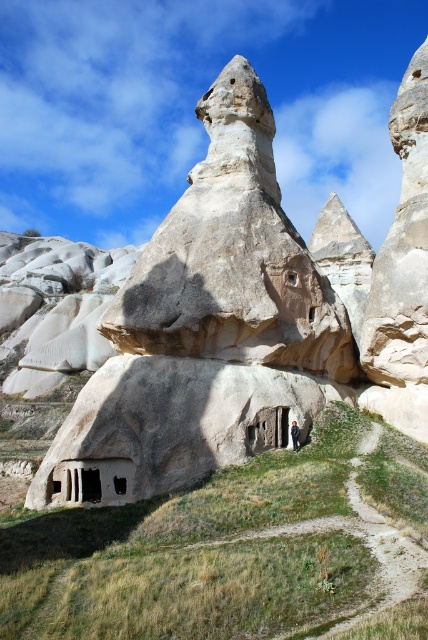
You are a hiker standing at the base of the beige stone rock formation at center. You notice a point marked at coordinates (x=205, y=328). Where is this point located relative to the beige stone rock formation at center?

The point marked at coordinates (x=205, y=328) is located at the center of the beige stone rock formation at center, indicating its central position.

You are a hiker standing in front of the beige stone rock formation at center and the smooth beige rock formation at center. Which one is closer to you?

The beige stone rock formation at center is closer to you since it is positioned in front of the smooth beige rock formation at center.

You are standing at the entrance of the beige stone rock formation at center. Where is the entrance located relative to the point marked at coordinates (205, 328)?

The entrance to the beige stone rock formation at center is located at the base of the structure near the point marked at coordinates (205, 328).